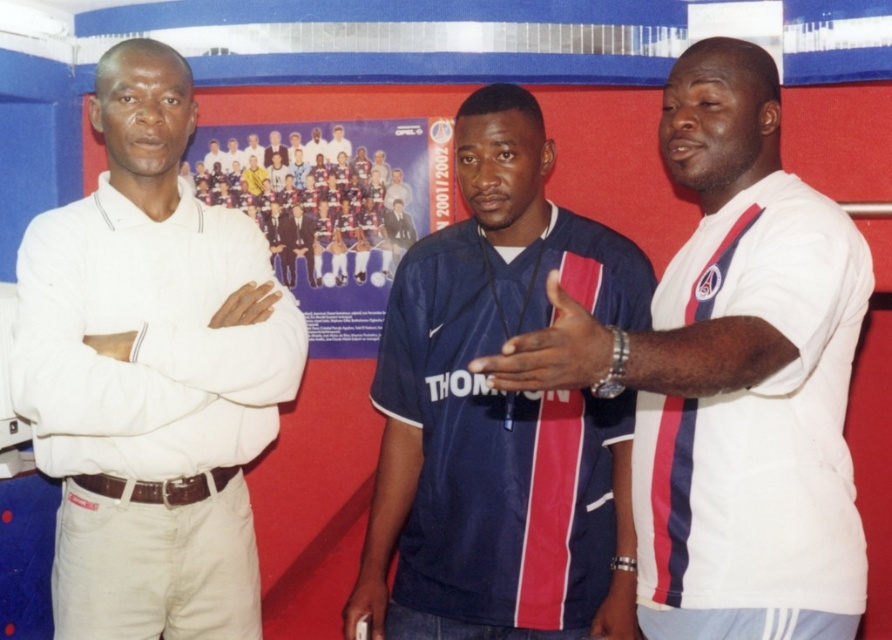
Consider the image. You are standing in the room and want to take a photo of the navy blue jersey at center. Based on its position coordinates, where should you aim your camera?

The navy blue jersey at center is located at coordinates point (500, 413), so aim your camera there to capture it.

You are a photographer setting up for a group photo. You need to ensure that the white striped shirt at right and the blue fabric shirt at center are visible in the frame. Based on their positions and the scene description, which shirt is more likely to be partially hidden if the camera angle is slightly shifted to the right?

The white striped shirt at right might be wider than the blue fabric shirt at center. If the camera angle shifts to the right, the wider white striped shirt at right could overlap more with the blue fabric shirt at center, potentially hiding part of it depending on their exact positions.

You are organizing a photo shoot and need to ensure that the white smooth shirt at left and the blue fabric poster at center are visible in the frame. Given their sizes, which object might require more careful positioning to avoid being cropped out?

The blue fabric poster at center requires more careful positioning because it is wider than the white smooth shirt at left, making it more prone to being cropped out if not framed properly.